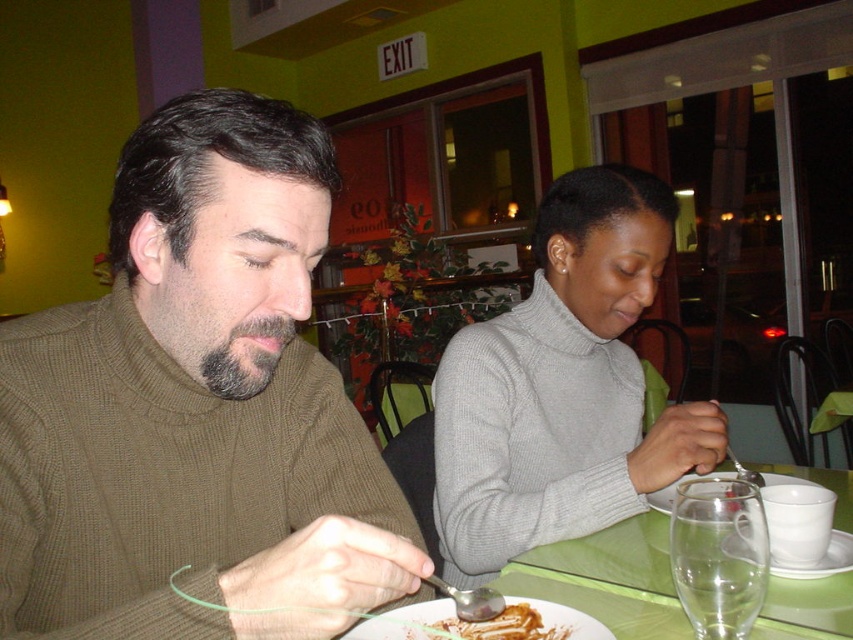
You are a waiter in a restaurant. You need to place a new order of soup for the customer wearing the gray woolen sweater at center. Where should you place the soup bowl relative to the golden brown crumbly pastry at lower center?

The gray woolen sweater at center is positioned over the golden brown crumbly pastry at lower center, so you should place the soup bowl on the table near the gray woolen sweater at center, above the golden brown crumbly pastry at lower center to ensure it reaches the correct customer.

You are a waiter at the restaurant and need to place a new dish on the table. There are two points marked on the table where you can place it. The points are labeled as point (619,566) and point (410,632). According to the scene description, which point is located behind the other when viewed from the perspective of the diners sitting at the table?

Point (619,566) is behind point (410,632) when viewed from the perspective of the diners sitting at the table.

You are a waiter in a restaurant and need to place a new order of soup on the table. The golden brown crumbly pastry at lower center is already on the green plastic table at lower center. Where should you place the soup bowl so it doesn t fall off the table?

The green plastic table at lower center is positioned on the right side of the golden brown crumbly pastry at lower center. To prevent the soup bowl from falling off, place it near the edge opposite to where the pastry is located, ensuring it stays within the table s boundaries.